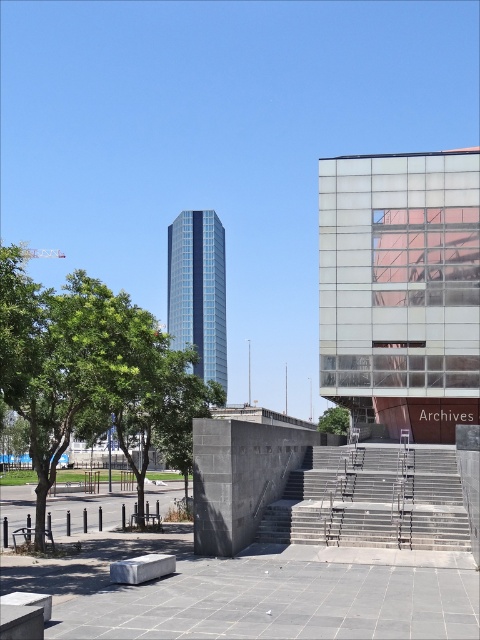
Who is taller, glassy reflective building at upper right or green leafy tree at left?

With more height is glassy reflective building at upper right.

Can you confirm if glassy reflective building at upper right is thinner than green leafy tree at left?

Yes, glassy reflective building at upper right is thinner than green leafy tree at left.

Does point (374, 339) lie in front of point (24, 317)?

No, it is behind (24, 317).

I want to click on glassy reflective building at upper right, so click(400, 289).

Which of these two, glassy reflective building at upper right or green leafy tree at center, stands shorter?

green leafy tree at center

Can you confirm if glassy reflective building at upper right is shorter than green leafy tree at center?

In fact, glassy reflective building at upper right may be taller than green leafy tree at center.

Does point (325, 330) lie in front of point (319, 428)?

That is True.

The image size is (480, 640). I want to click on glassy reflective building at upper right, so 400,289.

Who is higher up, glassy blue skyscraper at center or green leafy tree at center?

glassy blue skyscraper at center is higher up.

Can you confirm if glassy blue skyscraper at center is positioned above green leafy tree at center?

Indeed, glassy blue skyscraper at center is positioned over green leafy tree at center.

Between point (168, 314) and point (339, 426), which one is positioned in front?

Point (339, 426)

Where is `glassy blue skyscraper at center`? glassy blue skyscraper at center is located at coordinates (197, 291).